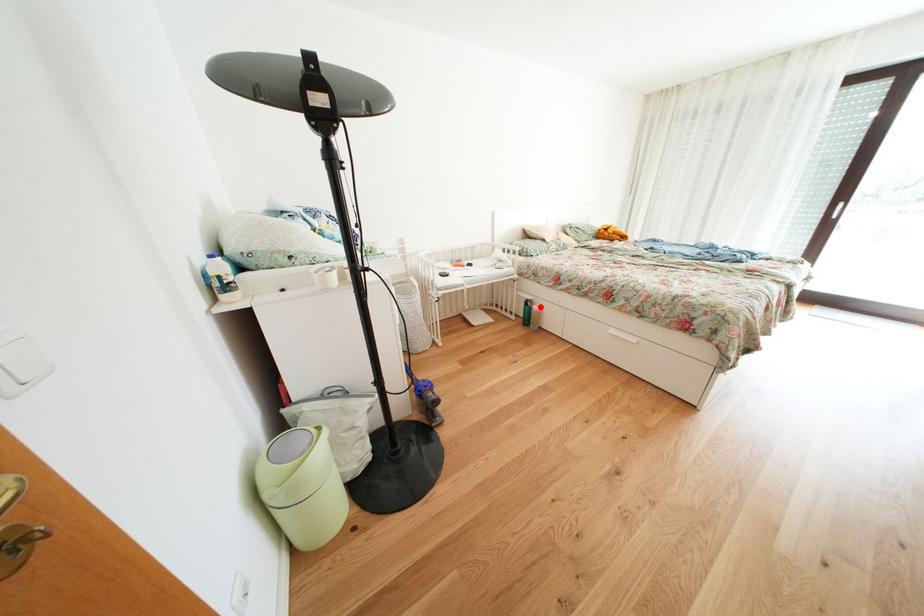
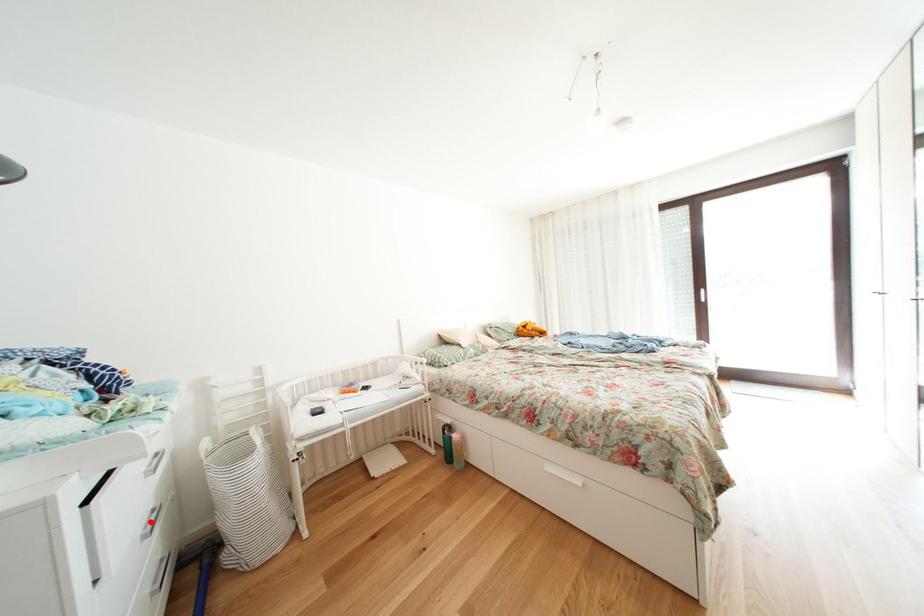
I am providing you with two images of the same scene from different viewpoints. A red point is marked on the first image and another point is marked on the second image. Are the points marked in image1 and image2 representing the same 3D position?

No